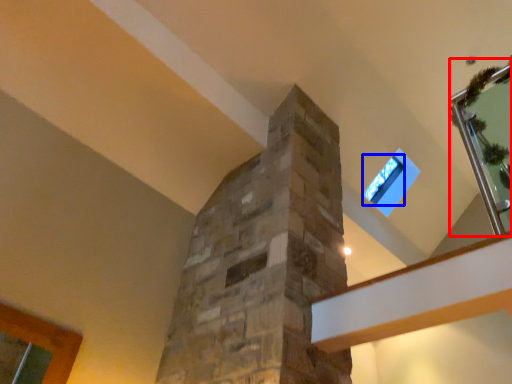
Question: Which object is closer to the camera taking this photo, glass door (highlighted by a red box) or window (highlighted by a blue box)?

Choices:
 (A) glass door
 (B) window

Answer: (A)